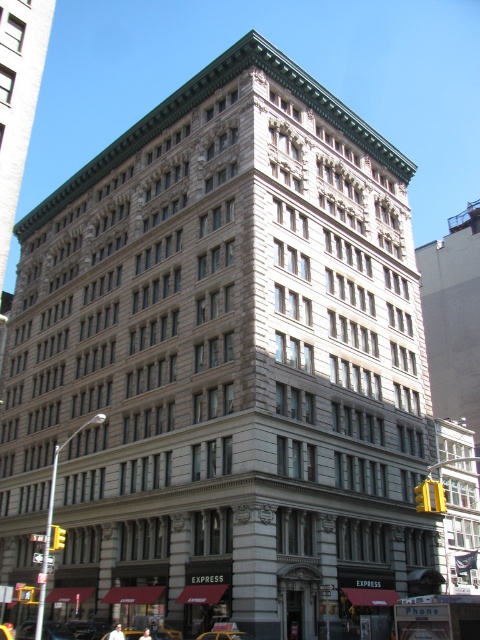
You are standing at the front entrance of the building and want to locate two specific points marked on the building facade. The first point is at coordinates point (49, 625) and the second point is at point (132, 637). Which of these points is closer to you when viewed from the entrance?

Point (132, 637) is closer to you because point (49, 625) is behind it.

You are standing at point (166, 634) in the image. What object is located at this point?

At point (166, 634) lies yellow metallic taxi cab at lower center.